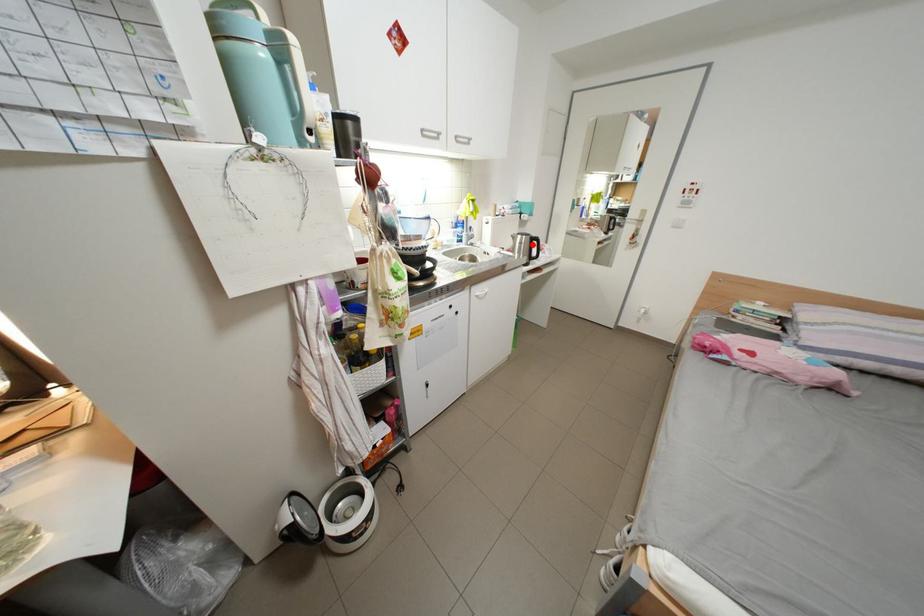
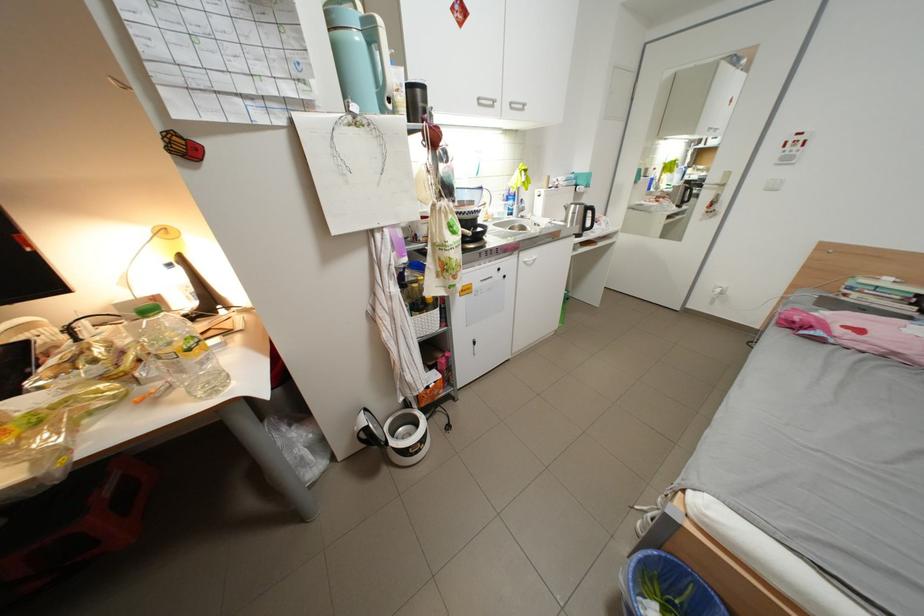
Where in the second image is the point corresponding to the highlighted location from the first image?

(585, 215)